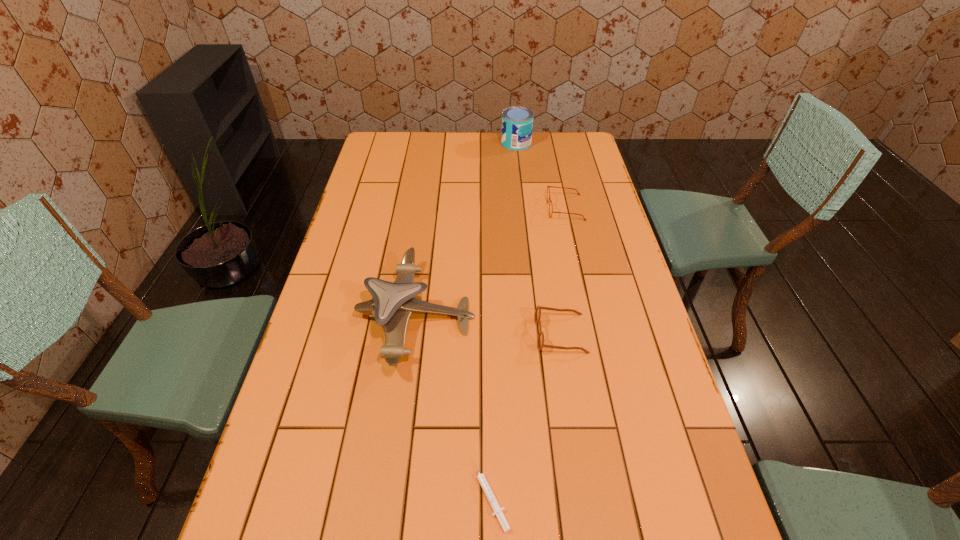
Locate an element on the screen. unoccupied area between the second farthest object and the farthest object is located at coordinates (540, 176).

The width and height of the screenshot is (960, 540). What are the coordinates of `free point between the can and the fourth shortest object` in the screenshot? It's located at (466, 230).

Locate an element on the screen. object that can be found as the second closest to the nearest object is located at coordinates (540, 341).

Where is `the second closest object to the farthest object`? This screenshot has height=540, width=960. the second closest object to the farthest object is located at coordinates (393, 303).

In order to click on vacant area in the image that satisfies the following two spatial constraints: 1. on the face of the fourth nearest object; 2. on the front side of the nearest object in this screenshot , I will do `click(629, 494)`.

The image size is (960, 540). Identify the location of free space that satisfies the following two spatial constraints: 1. on the front-facing side of the drone; 2. on the back side of the nearest object. (393, 494).